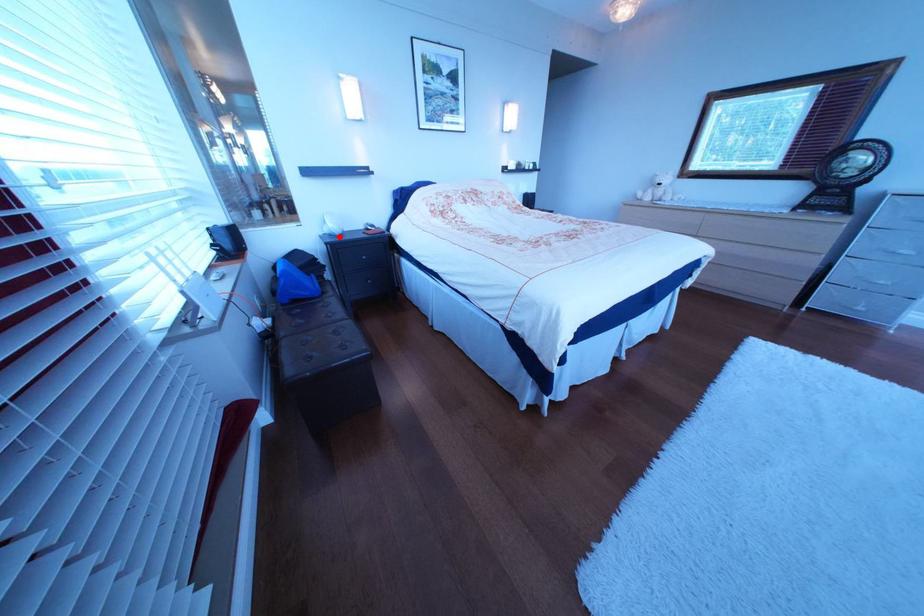
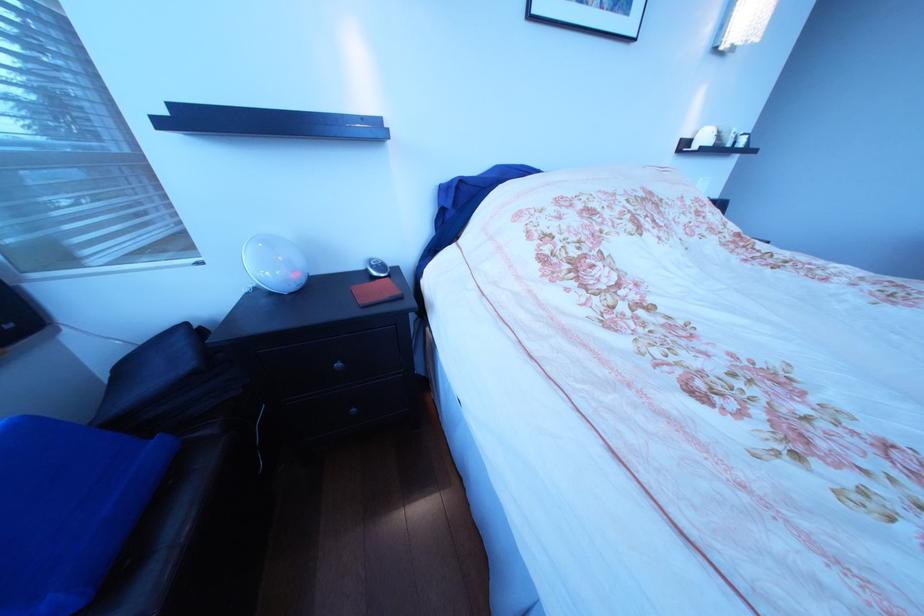
In the second image, find the point that corresponds to the highlighted location in the first image.

(272, 291)